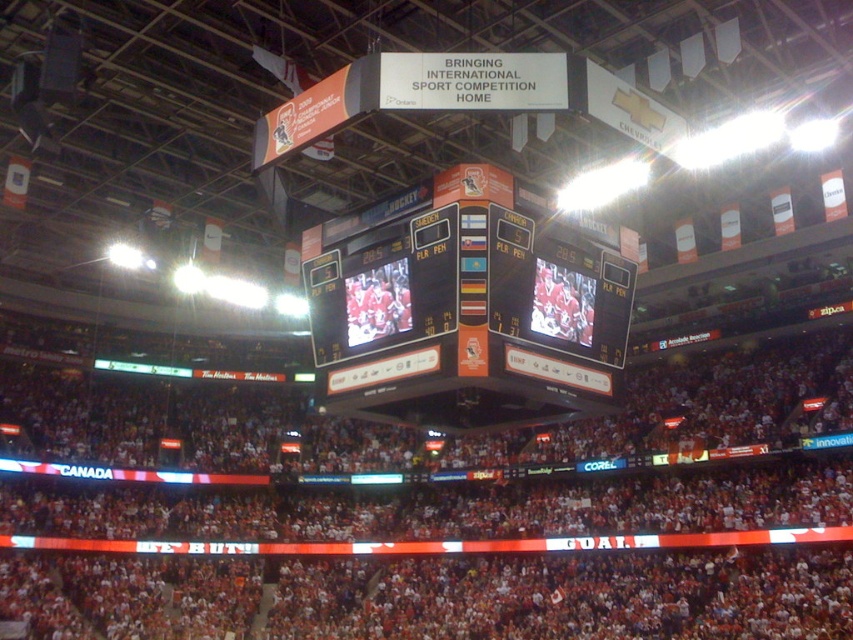
Question: Can you confirm if red fabric crowd at center is positioned to the right of orange glossy scoreboard at center?

Choices:
 (A) no
 (B) yes

Answer: (A)

Question: Which point is closer to the camera taking this photo?

Choices:
 (A) (488, 413)
 (B) (514, 568)

Answer: (A)

Question: Is red fabric crowd at center to the left of orange glossy scoreboard at center from the viewer's perspective?

Choices:
 (A) yes
 (B) no

Answer: (A)

Question: Does red fabric crowd at center have a larger size compared to orange glossy scoreboard at center?

Choices:
 (A) yes
 (B) no

Answer: (A)